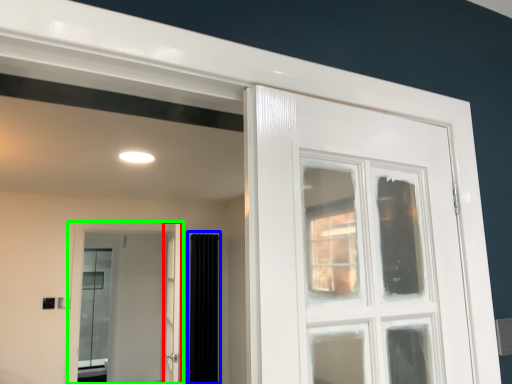
Question: Considering the real-world distances, which object is closest to screen door (highlighted by a red box)? curtain (highlighted by a blue box) or door (highlighted by a green box).

Choices:
 (A) curtain
 (B) door

Answer: (A)